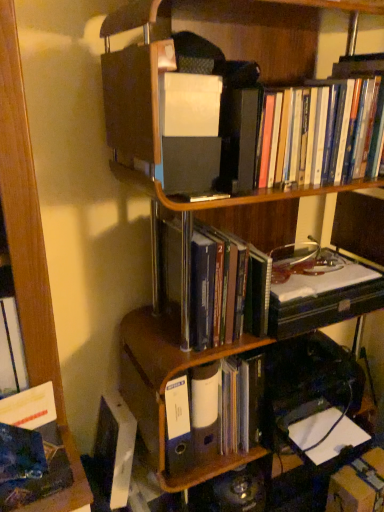
Question: From a real-world perspective, is hardcover books at upper right, which appears as the first book when viewed from the top, positioned over blue plastic ring binder at center based on gravity?

Choices:
 (A) no
 (B) yes

Answer: (B)

Question: Can you confirm if hardcover books at upper right, the third book from the bottom, is smaller than blue plastic ring binder at center?

Choices:
 (A) yes
 (B) no

Answer: (B)

Question: From the image's perspective, would you say hardcover books at upper right, which appears as the first book when viewed from the top, is positioned over blue plastic ring binder at center?

Choices:
 (A) no
 (B) yes

Answer: (B)

Question: Could you tell me if hardcover books at upper right, which appears as the first book when viewed from the top, is turned towards blue plastic ring binder at center?

Choices:
 (A) no
 (B) yes

Answer: (A)

Question: Does hardcover books at upper right, which appears as the first book when viewed from the top, have a lesser height compared to blue plastic ring binder at center?

Choices:
 (A) yes
 (B) no

Answer: (A)

Question: Is cardboard box at lower right inside the boundaries of matte plastic binder at center, the first book when ordered from bottom to top, or outside?

Choices:
 (A) inside
 (B) outside

Answer: (B)

Question: Considering the positions of cardboard box at lower right and matte plastic binder at center, the first book when ordered from bottom to top, in the image, is cardboard box at lower right bigger or smaller than matte plastic binder at center, the first book when ordered from bottom to top,?

Choices:
 (A) small
 (B) big

Answer: (A)

Question: From a real-world perspective, is cardboard box at lower right above or below matte plastic binder at center, the first book when ordered from bottom to top?

Choices:
 (A) above
 (B) below

Answer: (B)

Question: Is cardboard box at lower right taller or shorter than matte plastic binder at center, the first book when ordered from bottom to top?

Choices:
 (A) short
 (B) tall

Answer: (A)

Question: From a real-world perspective, is cardboard box at lower right above or below hardcover books at upper right, the third book from the bottom?

Choices:
 (A) below
 (B) above

Answer: (A)

Question: In terms of height, does cardboard box at lower right look taller or shorter compared to hardcover books at upper right, the third book from the bottom?

Choices:
 (A) short
 (B) tall

Answer: (A)

Question: In the image, is cardboard box at lower right on the left side or the right side of hardcover books at upper right, the third book from the bottom?

Choices:
 (A) right
 (B) left

Answer: (A)

Question: Considering the positions of cardboard box at lower right and hardcover books at upper right, which appears as the first book when viewed from the top, in the image, is cardboard box at lower right wider or thinner than hardcover books at upper right, which appears as the first book when viewed from the top,?

Choices:
 (A) thin
 (B) wide

Answer: (A)

Question: Is blue plastic ring binder at center bigger or smaller than cardboard box at lower right?

Choices:
 (A) big
 (B) small

Answer: (A)

Question: Is blue plastic ring binder at center spatially inside cardboard box at lower right, or outside of it?

Choices:
 (A) outside
 (B) inside

Answer: (A)